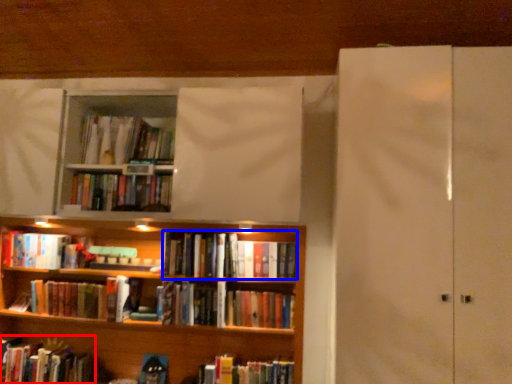
Question: Which object appears closest to the camera in this image, book (highlighted by a red box) or book (highlighted by a blue box)?

Choices:
 (A) book
 (B) book

Answer: (B)